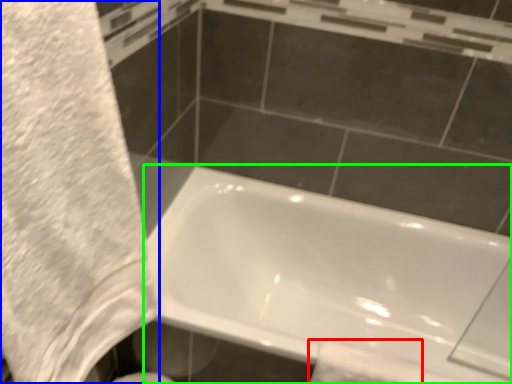
Question: Which is farther away from toilet paper (highlighted by a red box)? bath towel (highlighted by a blue box) or bathtub (highlighted by a green box)?

Choices:
 (A) bath towel
 (B) bathtub

Answer: (A)